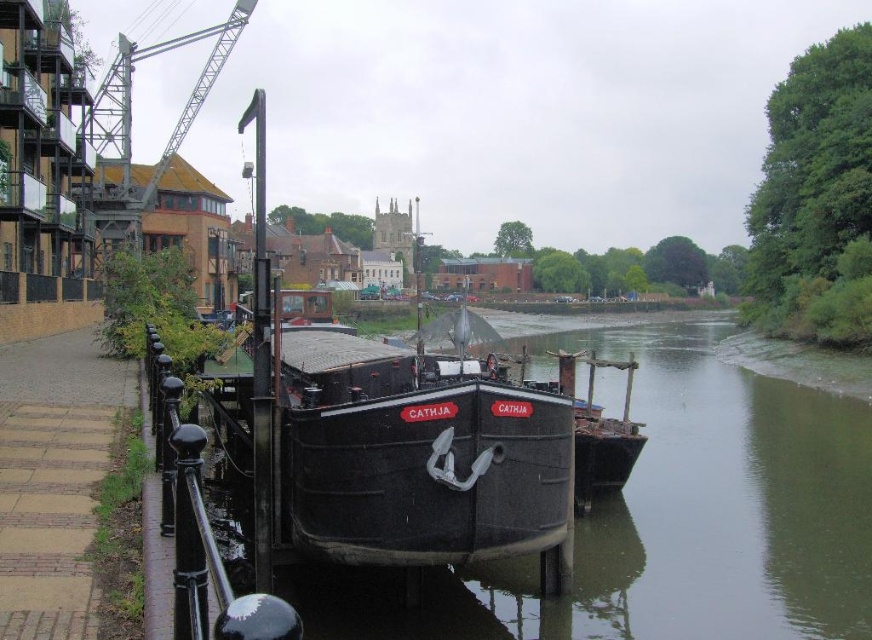
Is black matte boat at center bigger than black metal/rail at left?

Yes.

Does black matte boat at center appear under black metal/rail at left?

No.

Locate an element on the screen. The image size is (872, 640). black matte boat at center is located at coordinates (673, 512).

Identify the location of black matte boat at center. The image size is (872, 640). (673, 512).

Is black metal/rail at left to the right of metallic gray crane at upper left from the viewer's perspective?

Yes, black metal/rail at left is to the right of metallic gray crane at upper left.

Which is more to the left, black metal/rail at left or metallic gray crane at upper left?

From the viewer's perspective, metallic gray crane at upper left appears more on the left side.

What do you see at coordinates (198, 524) in the screenshot?
I see `black metal/rail at left` at bounding box center [198, 524].

Where is `black metal/rail at left`? black metal/rail at left is located at coordinates 198,524.

Does black matte boat at center appear on the right side of metallic gray crane at upper left?

Correct, you'll find black matte boat at center to the right of metallic gray crane at upper left.

Which of these two, black matte boat at center or metallic gray crane at upper left, stands taller?

Standing taller between the two is metallic gray crane at upper left.

The width and height of the screenshot is (872, 640). Identify the location of black matte boat at center. (673, 512).